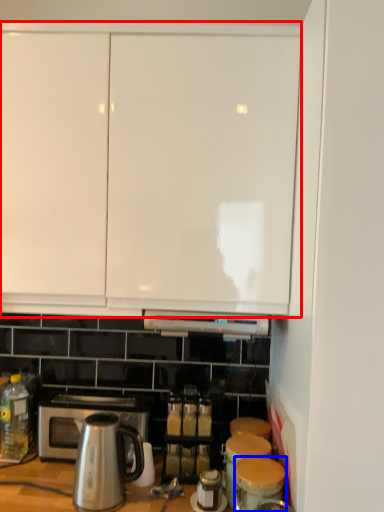
Question: Which of the following is the closest to the observer, cabinetry (highlighted by a red box) or appliance (highlighted by a blue box)?

Choices:
 (A) cabinetry
 (B) appliance

Answer: (B)